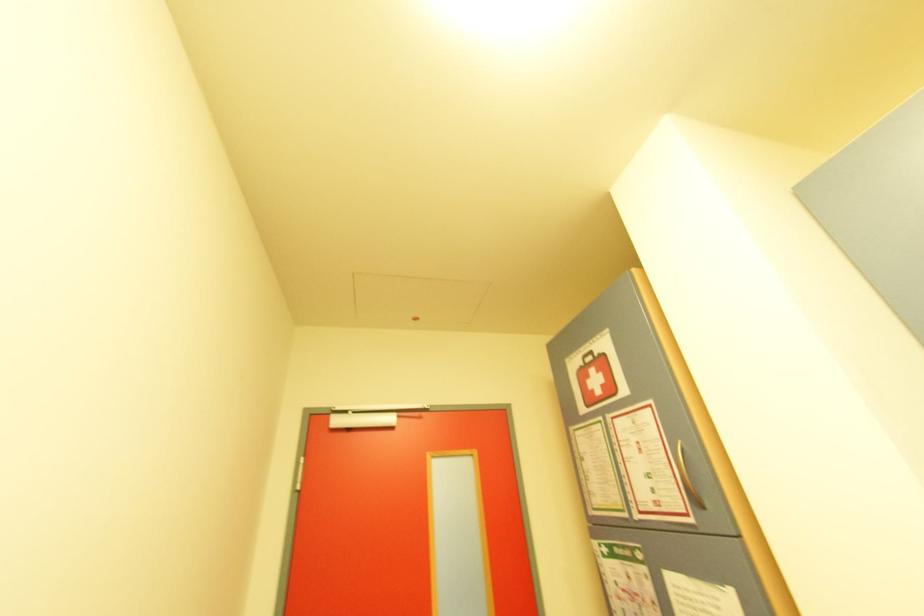
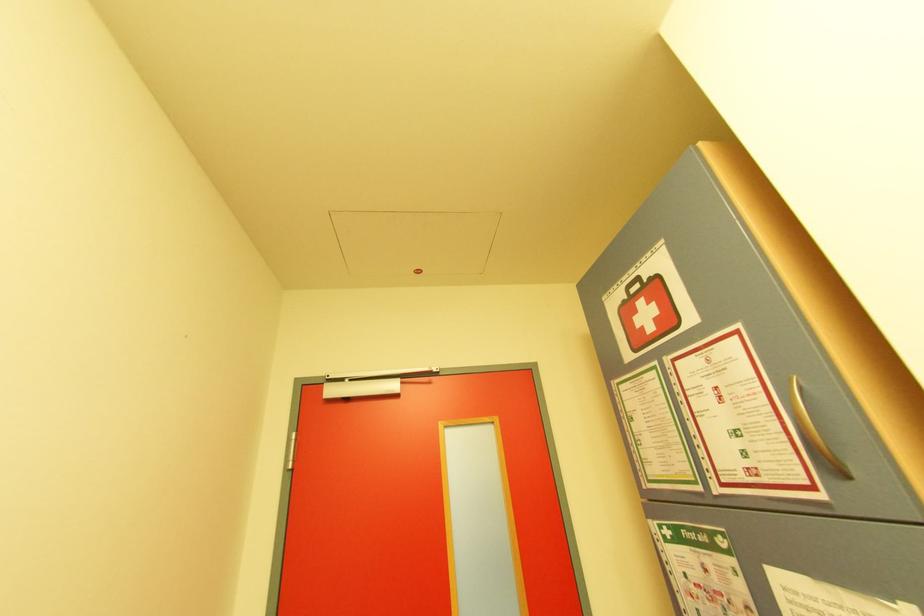
Question: What movement of the cameraman would produce the second image?

Choices:
 (A) Left
 (B) Right
 (C) Forward
 (D) Backward

Answer: (C)